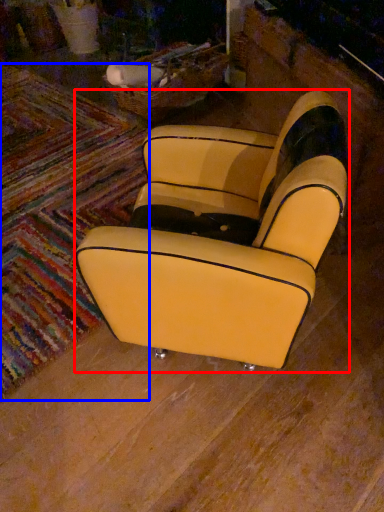
Question: Which of the following is the closest to the observer, chair (highlighted by a red box) or mat (highlighted by a blue box)?

Choices:
 (A) chair
 (B) mat

Answer: (A)